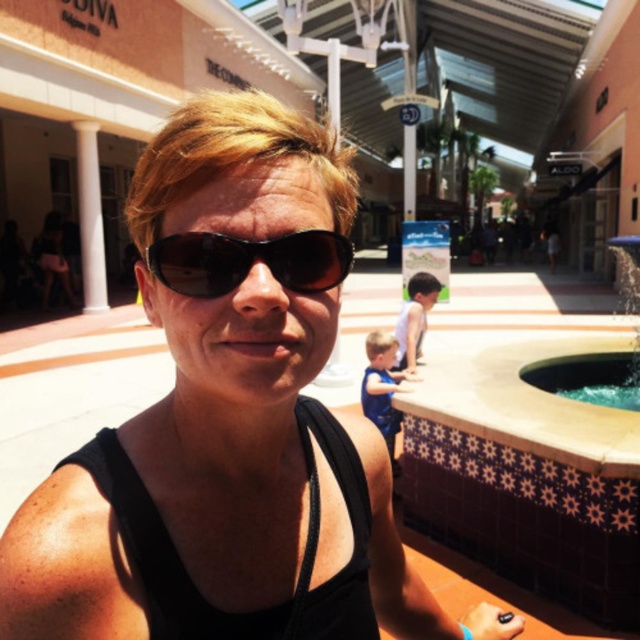
Question: Which of the following is the closest to the observer?

Choices:
 (A) (269, 621)
 (B) (612, 352)
 (C) (236, 269)

Answer: (C)

Question: Can you confirm if clear glass pool at lower right is positioned to the left of white marble pillar at left?

Choices:
 (A) no
 (B) yes

Answer: (A)

Question: Can you confirm if black fabric vest at center is smaller than white marble pillar at left?

Choices:
 (A) no
 (B) yes

Answer: (B)

Question: Which of the following is the closest to the observer?

Choices:
 (A) sunglasses at center
 (B) black fabric vest at center
 (C) white marble pillar at left

Answer: (A)

Question: Observing the image, what is the correct spatial positioning of clear glass pool at lower right in reference to white marble pillar at left?

Choices:
 (A) right
 (B) left

Answer: (A)

Question: Estimate the real-world distances between objects in this image. Which object is closer to the white marble pillar at left?

Choices:
 (A) black fabric vest at center
 (B) sunglasses at center

Answer: (A)